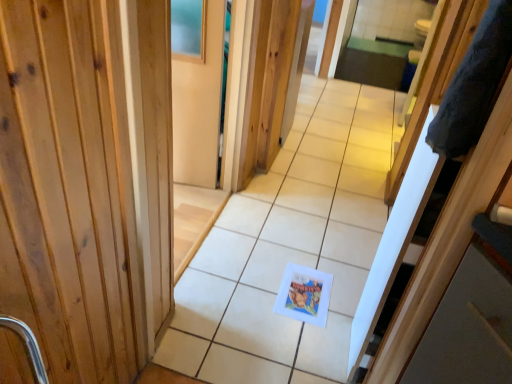
The width and height of the screenshot is (512, 384). I want to click on vacant region below wooden at center (from a real-world perspective), so click(203, 230).